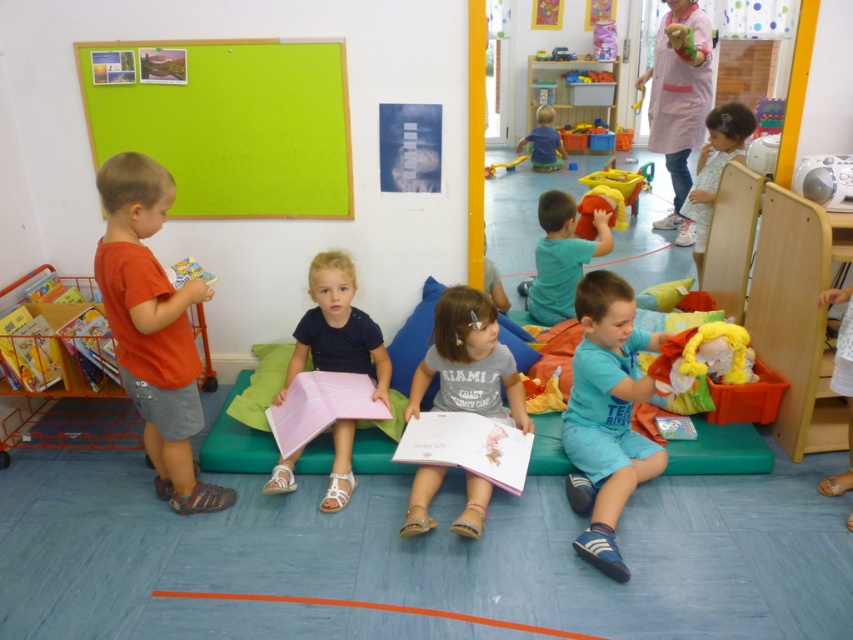
Question: Is orange cotton shirt at left further to camera compared to light blue floral dress at right?

Choices:
 (A) no
 (B) yes

Answer: (A)

Question: Which of the following is the closest to the observer?

Choices:
 (A) green felt board at upper left
 (B) pink paper at center
 (C) teal matte shirt at center
 (D) yellow plastic slide at center

Answer: (B)

Question: Is green felt board at upper left to the right of teal matte shirt at center from the viewer's perspective?

Choices:
 (A) yes
 (B) no

Answer: (B)

Question: Considering the real-world distances, which object is farthest from the pink paper at center?

Choices:
 (A) orange cotton shirt at left
 (B) green felt board at upper left

Answer: (B)

Question: Which object appears farthest from the camera in this image?

Choices:
 (A) pink paper at center
 (B) blue cotton shorts at lower right
 (C) teal matte shirt at center

Answer: (C)

Question: Does matte pink book at center lie behind yellow plastic slide at center?

Choices:
 (A) no
 (B) yes

Answer: (A)